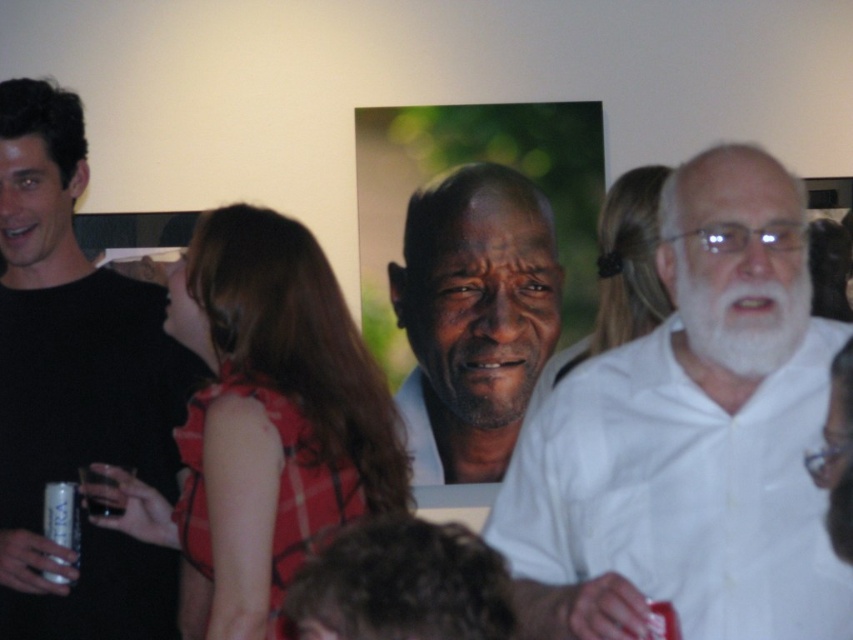
You are a photographer setting up for a group photo. You need to position the white matte shirt at right and the black matte shirt at left so that they are exactly 1 meter apart. Based on the current scene, do you need to move them closer or farther apart?

The distance between the white matte shirt at right and the black matte shirt at left is currently 1.04 meters. Since 1.04 meters is slightly more than 1 meter, you should move them closer to achieve the desired distance.

You are standing in the social gathering scene. You need to locate the white matte shirt at right. Where exactly is it positioned in the image?

The white matte shirt at right is positioned at point coordinates of 0.686 on the x axis and 0.809 on the y axis.

You are standing in the room and want to reach both the point at coordinates (x=141, y=563) and the point at coordinates (x=769, y=332). Which point will you reach first?

You will reach the point at coordinates (x=141, y=563) first because it is closer to you than the point at coordinates (x=769, y=332), which is further away.